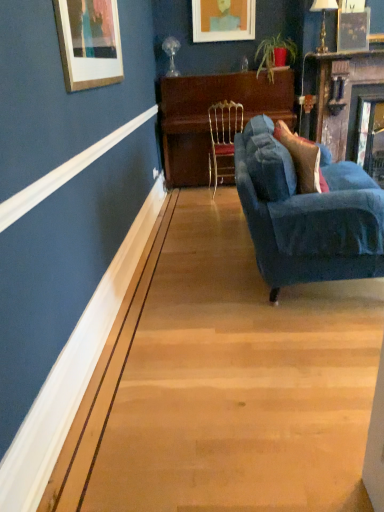
Question: Considering the relative sizes of wooden piano at center and wooden mantel at upper right in the image provided, is wooden piano at center thinner than wooden mantel at upper right?

Choices:
 (A) no
 (B) yes

Answer: (B)

Question: Is wooden piano at center far from wooden mantel at upper right?

Choices:
 (A) yes
 (B) no

Answer: (B)

Question: From the image's perspective, would you say wooden piano at center is shown under wooden mantel at upper right?

Choices:
 (A) yes
 (B) no

Answer: (B)

Question: From a real-world perspective, is wooden piano at center located higher than wooden mantel at upper right?

Choices:
 (A) no
 (B) yes

Answer: (A)

Question: Would you say wooden piano at center is outside wooden mantel at upper right?

Choices:
 (A) no
 (B) yes

Answer: (B)

Question: Is matte orange picture frame at upper center wider or thinner than wooden piano at center?

Choices:
 (A) wide
 (B) thin

Answer: (B)

Question: Is point (243, 34) closer or farther from the camera than point (206, 76)?

Choices:
 (A) closer
 (B) farther

Answer: (A)

Question: Is matte orange picture frame at upper center inside the boundaries of wooden piano at center, or outside?

Choices:
 (A) outside
 (B) inside

Answer: (A)

Question: Is matte orange picture frame at upper center in front of or behind wooden piano at center in the image?

Choices:
 (A) front
 (B) behind

Answer: (B)

Question: Is matte orange picture frame at upper center inside the boundaries of gold wire chair at center, or outside?

Choices:
 (A) inside
 (B) outside

Answer: (B)

Question: Is matte orange picture frame at upper center wider or thinner than gold wire chair at center?

Choices:
 (A) thin
 (B) wide

Answer: (A)

Question: Looking at the image, does matte orange picture frame at upper center seem bigger or smaller compared to gold wire chair at center?

Choices:
 (A) small
 (B) big

Answer: (A)

Question: From the image's perspective, is matte orange picture frame at upper center above or below gold wire chair at center?

Choices:
 (A) above
 (B) below

Answer: (A)

Question: Considering the positions of wooden piano at center and matte orange picture frame at upper center in the image, is wooden piano at center bigger or smaller than matte orange picture frame at upper center?

Choices:
 (A) big
 (B) small

Answer: (A)

Question: Is wooden piano at center in front of or behind matte orange picture frame at upper center in the image?

Choices:
 (A) behind
 (B) front

Answer: (B)